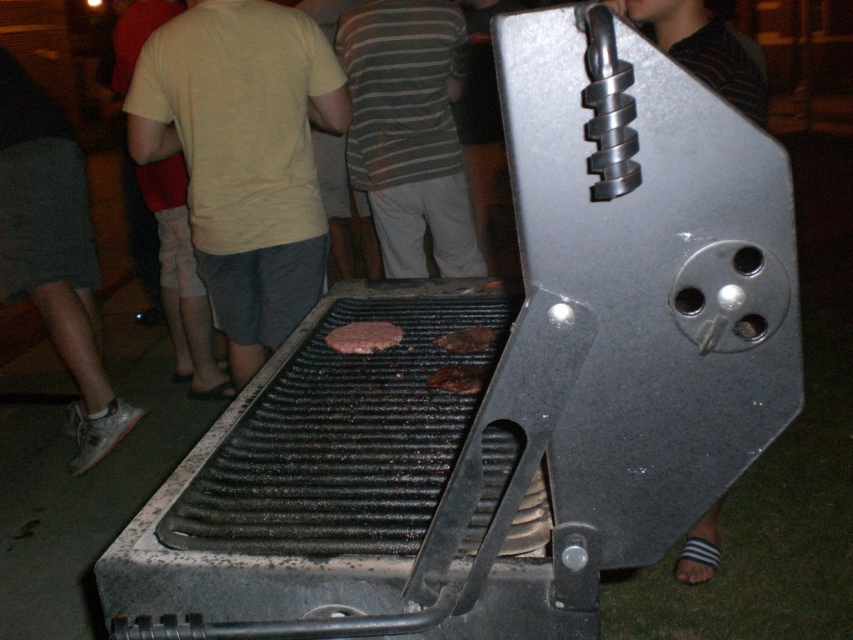
Between point (282, 28) and point (361, 163), which one is positioned in front?

Point (282, 28) is in front.

Between matte yellow t-shirt at center and striped fabric shirt at center, which one is positioned lower?

matte yellow t-shirt at center is lower down.

Between point (300, 84) and point (351, 36), which one is positioned behind?

Positioned behind is point (351, 36).

The image size is (853, 640). I want to click on matte yellow t-shirt at center, so click(244, 156).

Can you confirm if matte yellow t-shirt at center is shorter than brown charred burger patty at center?

In fact, matte yellow t-shirt at center may be taller than brown charred burger patty at center.

Between point (277, 61) and point (457, 353), which one is positioned behind?

The point (277, 61) is more distant.

Find the location of a particular element. The height and width of the screenshot is (640, 853). matte yellow t-shirt at center is located at coordinates (244, 156).

In the scene shown: Which of these two, matte yellow t-shirt at center or brown charred meat at center, stands shorter?

brown charred meat at center is shorter.

Image resolution: width=853 pixels, height=640 pixels. Identify the location of matte yellow t-shirt at center. (244, 156).